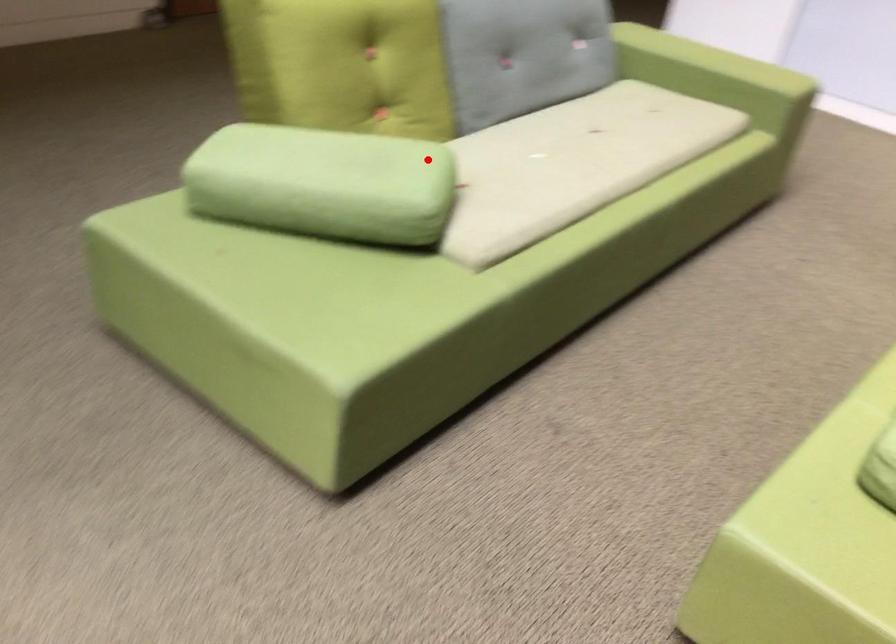
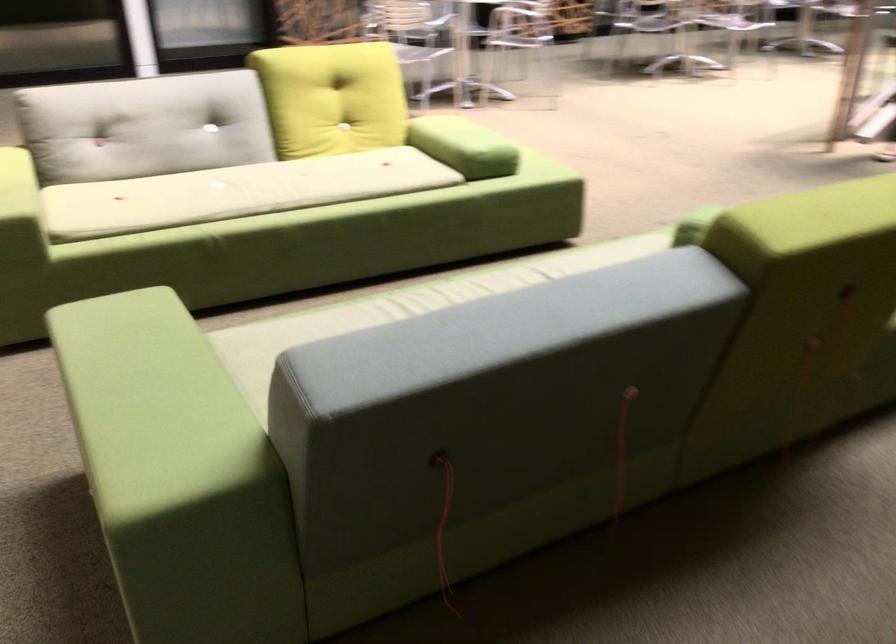
Question: A red point is marked in image1. In image2, is the corresponding 3D point closer to the camera or farther? Reply with the corresponding letter.

Choices:
 (A) The corresponding 3D point is closer.
 (B) The corresponding 3D point is farther.

Answer: (B)